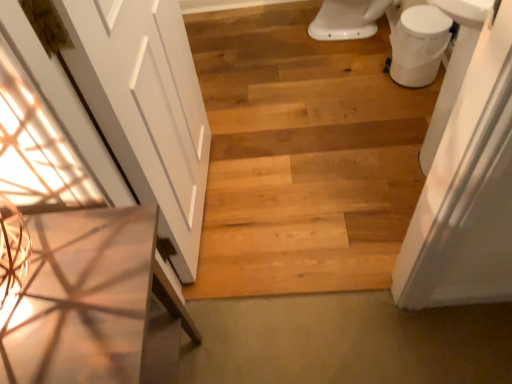
You are a GUI agent. You are given a task and a screenshot of the screen. Output one action in this format:
    pyautogui.click(x=<x>, y=<y>)
    Task: Click on the free space in front of white matte door at left
    The image size is (512, 384).
    Given the screenshot: What is the action you would take?
    pyautogui.click(x=246, y=255)